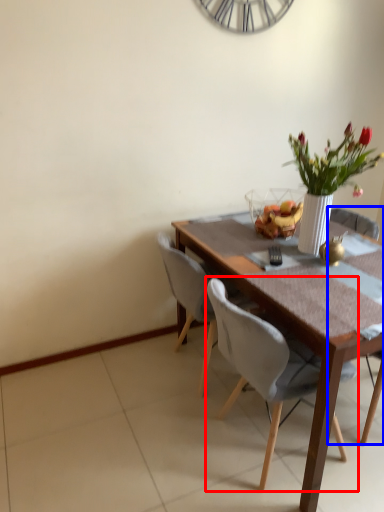
Question: Which point is closer to the camera, chair (highlighted by a red box) or chair (highlighted by a blue box)?

Choices:
 (A) chair
 (B) chair

Answer: (A)